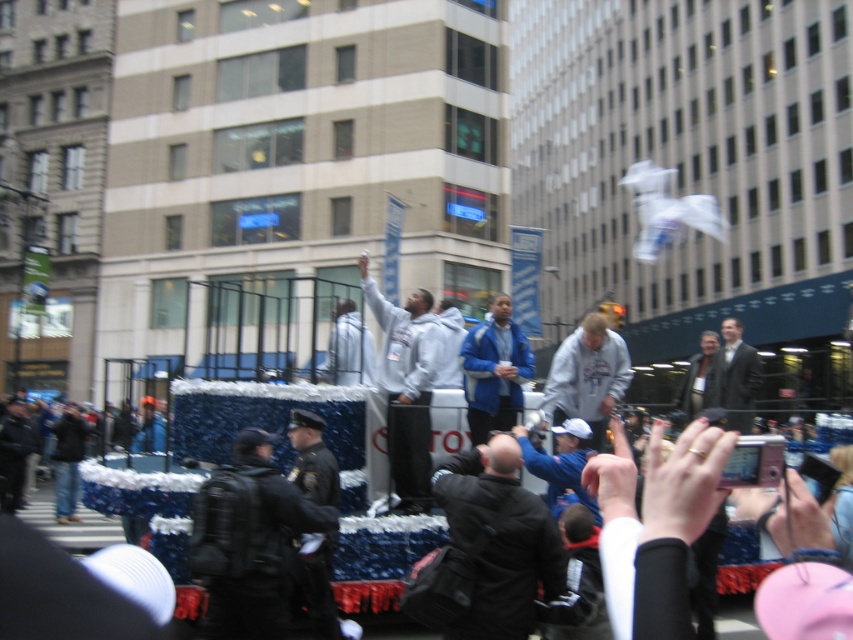
Based on the photo, you are a photographer trying to capture both the black leather jacket at center and the gray fleece sweatshirt at center in a single frame. Since you want both items to be clearly visible, does the size difference between them pose a problem for your shot?

The black leather jacket at center is bigger than the gray fleece sweatshirt at center, so the size difference may make it challenging to ensure both are clearly visible in the same frame without one overpowering the other.